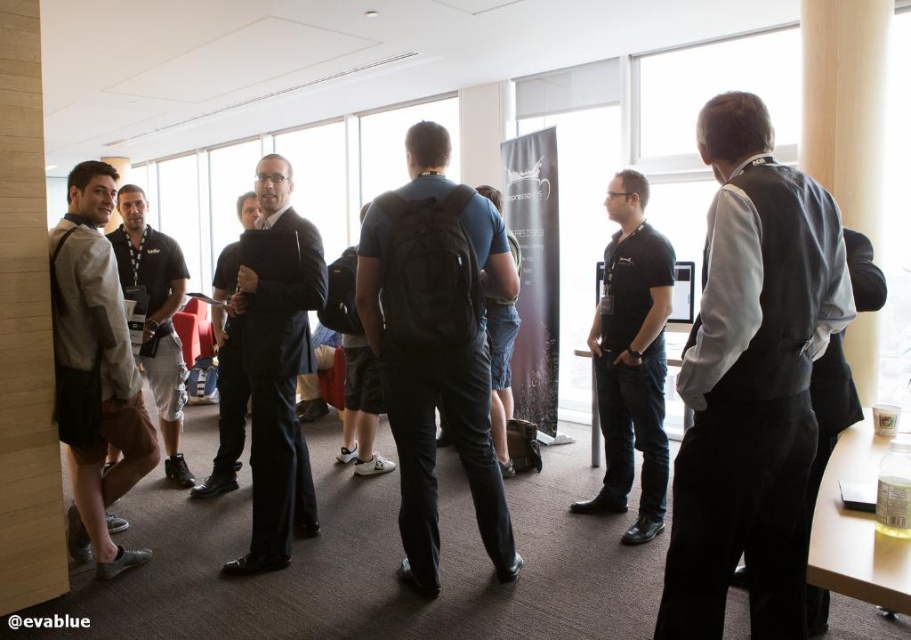
Question: Which is farther from the wooden table at right?

Choices:
 (A) black matte shirt at center
 (B) matte black backpack at center
 (C) dark blue backpack at center
 (D) black matte backpack at center

Answer: (D)

Question: Is light brown leather shorts at left positioned behind wooden table at right?

Choices:
 (A) no
 (B) yes

Answer: (A)

Question: Is dark blue backpack at center wider than wooden table at right?

Choices:
 (A) no
 (B) yes

Answer: (B)

Question: Observing the image, what is the correct spatial positioning of dark gray vest at right in reference to wooden pillar at left?

Choices:
 (A) right
 (B) left

Answer: (A)

Question: Which point is closer to the camera?

Choices:
 (A) dark gray vest at right
 (B) dark blue backpack at center
 (C) matte black suit at center
 (D) matte black shirt at left

Answer: (A)

Question: Which object appears closest to the camera in this image?

Choices:
 (A) black matte shirt at center
 (B) matte black backpack at center
 (C) dark blue backpack at center
 (D) wooden table at right

Answer: (C)